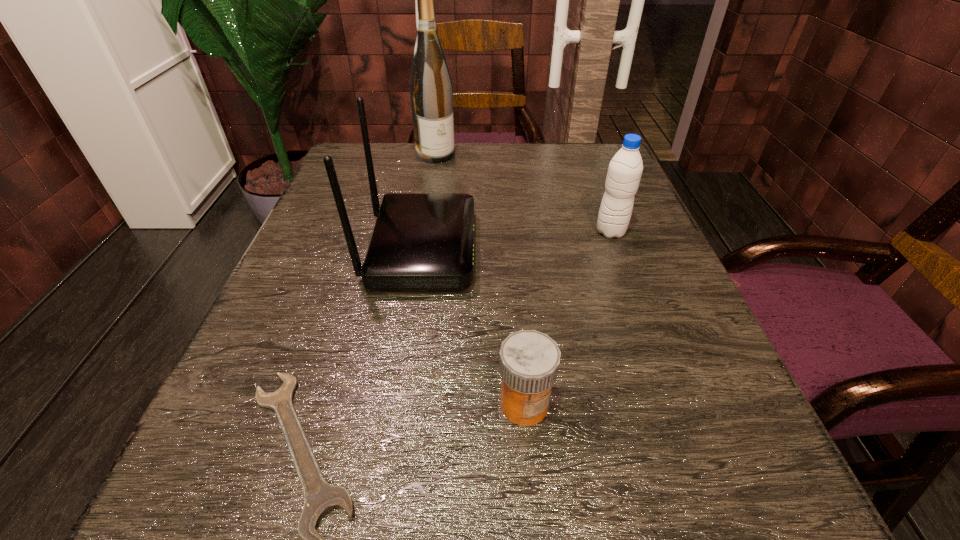
You are a GUI agent. You are given a task and a screenshot of the screen. Output one action in this format:
    pyautogui.click(x=<x>, y=<y>)
    Task: Click on the unoccupied position between the wine bottle and the fourth object from left to right
    Image resolution: width=960 pixels, height=540 pixels.
    Given the screenshot: What is the action you would take?
    pyautogui.click(x=480, y=279)

This screenshot has width=960, height=540. Find the location of `empty location between the farthest object and the water bottle`. empty location between the farthest object and the water bottle is located at coordinates (523, 193).

Identify which object is located as the nearest to the tallest object. Please provide its 2D coordinates. Your answer should be formatted as a tuple, i.e. [(x, y)], where the tuple contains the x and y coordinates of a point satisfying the conditions above.

[(420, 240)]

The image size is (960, 540). Find the location of `object that stands as the closest to the wrench`. object that stands as the closest to the wrench is located at coordinates (529, 360).

Locate an element on the screen. The image size is (960, 540). free space in the image that satisfies the following two spatial constraints: 1. on the front side of the wine bottle; 2. on the left side of the rightmost object is located at coordinates (423, 232).

In order to click on free location that satisfies the following two spatial constraints: 1. on the front side of the tallest object; 2. on the left side of the water bottle in this screenshot , I will do `click(423, 232)`.